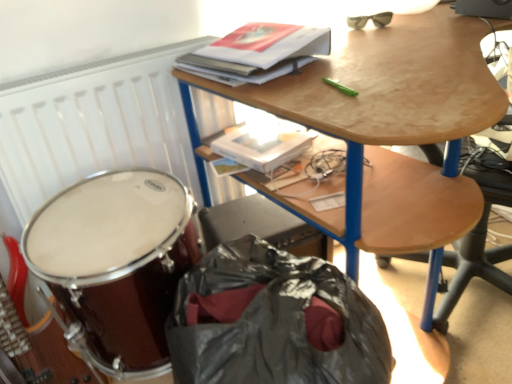
Question: From a real-world perspective, is wooden desk at upper center positioned under shiny brown drum at lower left based on gravity?

Choices:
 (A) no
 (B) yes

Answer: (A)

Question: Is wooden desk at upper center at the right side of shiny brown drum at lower left?

Choices:
 (A) no
 (B) yes

Answer: (B)

Question: From the image's perspective, would you say wooden desk at upper center is positioned over shiny brown drum at lower left?

Choices:
 (A) no
 (B) yes

Answer: (B)

Question: Considering the relative positions of wooden desk at upper center and shiny brown drum at lower left in the image provided, is wooden desk at upper center to the left of shiny brown drum at lower left from the viewer's perspective?

Choices:
 (A) no
 (B) yes

Answer: (A)

Question: Is the depth of wooden desk at upper center greater than that of shiny brown drum at lower left?

Choices:
 (A) yes
 (B) no

Answer: (B)

Question: From the image's perspective, is wooden desk at upper center located beneath shiny brown drum at lower left?

Choices:
 (A) yes
 (B) no

Answer: (B)

Question: Considering the relative sizes of matte black sunglasses at upper right and wooden desk at upper center in the image provided, is matte black sunglasses at upper right smaller than wooden desk at upper center?

Choices:
 (A) no
 (B) yes

Answer: (B)

Question: Is matte black sunglasses at upper right not near wooden desk at upper center?

Choices:
 (A) yes
 (B) no

Answer: (B)

Question: Can you confirm if matte black sunglasses at upper right is taller than wooden desk at upper center?

Choices:
 (A) no
 (B) yes

Answer: (A)

Question: Is matte black sunglasses at upper right shorter than wooden desk at upper center?

Choices:
 (A) no
 (B) yes

Answer: (B)

Question: Considering the relative sizes of matte black sunglasses at upper right and wooden desk at upper center in the image provided, is matte black sunglasses at upper right wider than wooden desk at upper center?

Choices:
 (A) no
 (B) yes

Answer: (A)

Question: Is matte black sunglasses at upper right surrounding wooden desk at upper center?

Choices:
 (A) no
 (B) yes

Answer: (A)

Question: From a real-world perspective, does white matte radiator at upper left stand above hardcover book at upper center?

Choices:
 (A) yes
 (B) no

Answer: (B)